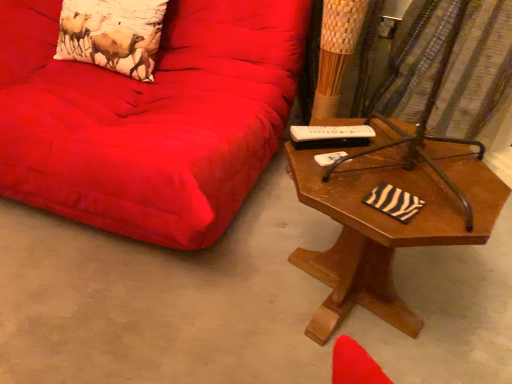
The image size is (512, 384). Identify the location of vacant space to the right of brown wooden table at right. (472, 299).